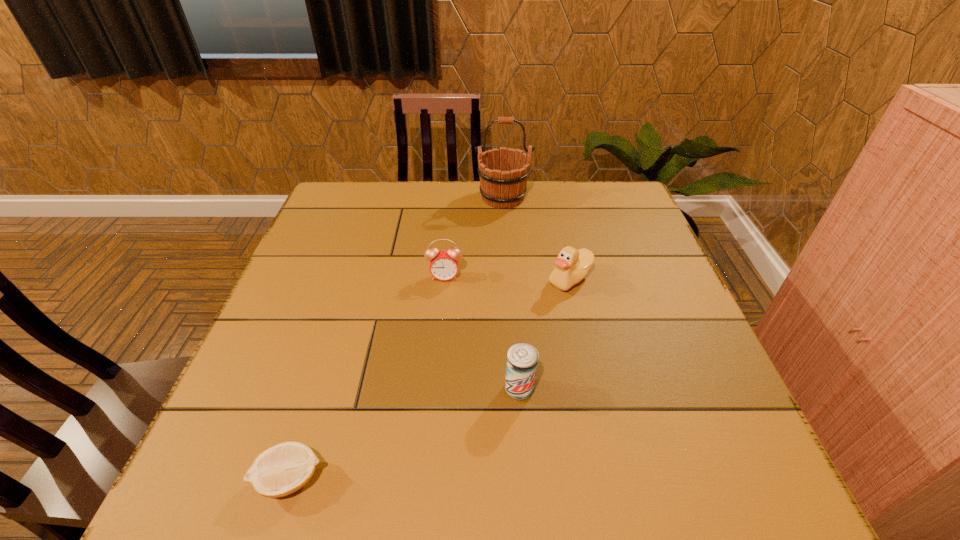
Image resolution: width=960 pixels, height=540 pixels. I want to click on vacant space at the left edge, so click(x=317, y=258).

In the image, there is a desktop. Where is `vacant space at the right edge`? This screenshot has height=540, width=960. vacant space at the right edge is located at coordinates (676, 450).

Where is `free region at the far left corner of the desktop`? The height and width of the screenshot is (540, 960). free region at the far left corner of the desktop is located at coordinates (334, 188).

In the image, there is a desktop. Find the location of `vacant space at the near left corner`. vacant space at the near left corner is located at coordinates (250, 501).

Where is `vacant region at the near right corner`? This screenshot has height=540, width=960. vacant region at the near right corner is located at coordinates (708, 469).

Where is `vacant point located between the beer can and the shortest object`? This screenshot has width=960, height=540. vacant point located between the beer can and the shortest object is located at coordinates pos(405,434).

Where is `free area in between the beer can and the rightmost object`? This screenshot has height=540, width=960. free area in between the beer can and the rightmost object is located at coordinates (545, 334).

Locate an element on the screen. The image size is (960, 540). vacant area between the alarm clock and the second nearest object is located at coordinates (482, 333).

At what (x,y) coordinates should I click in order to perform the action: click on free point between the duck and the shortest object. Please return your answer as a coordinate pair (x, y). Looking at the image, I should click on (430, 380).

You are a GUI agent. You are given a task and a screenshot of the screen. Output one action in this format:
    pyautogui.click(x=<x>, y=<y>)
    Task: Click on the free space between the leftmost object and the farthest object
    
    Given the screenshot: What is the action you would take?
    pyautogui.click(x=396, y=339)